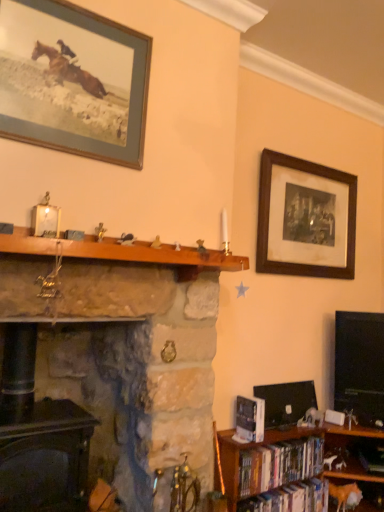
Describe the element at coordinates (250, 418) in the screenshot. I see `white glossy bookshelf at lower right, which is the 1th book in top-to-bottom order` at that location.

What do you see at coordinates (44, 455) in the screenshot?
I see `dark wood fireplace at lower left, acting as the first fireplace starting from the left` at bounding box center [44, 455].

Where is `wooden picture frame at upper right, the 1th picture frame in the back-to-front sequence`? wooden picture frame at upper right, the 1th picture frame in the back-to-front sequence is located at coordinates (305, 218).

This screenshot has height=512, width=384. In order to click on wooden at center in this screenshot , I will do `click(121, 252)`.

Looking at this image, do you think hardcover books at lower right, which is the 2th book from bottom to top, is within wooden bookshelf at lower right, or outside of it?

hardcover books at lower right, which is the 2th book from bottom to top, exists entirely within wooden bookshelf at lower right.

In the image, is hardcover books at lower right, which is the 2th book from bottom to top, positioned in front of or behind wooden bookshelf at lower right?

hardcover books at lower right, which is the 2th book from bottom to top, is behind wooden bookshelf at lower right.

Considering the relative sizes of hardcover books at lower right, the 2th book viewed from the top, and wooden bookshelf at lower right in the image provided, is hardcover books at lower right, the 2th book viewed from the top, wider than wooden bookshelf at lower right?

No.

Is wooden bookshelf at lower right at the back of hardcover books at lower right, the 2th book viewed from the top?

Yes, hardcover books at lower right, the 2th book viewed from the top, is facing away from wooden bookshelf at lower right.

Is blue matte picture frame at upper left, arranged as the 1th picture frame when viewed from the front, located outside wooden at center?

Yes, blue matte picture frame at upper left, arranged as the 1th picture frame when viewed from the front, is located beyond the bounds of wooden at center.

In the scene shown: From the image's perspective, is blue matte picture frame at upper left, which is counted as the 1th picture frame, starting from the left, above or below wooden at center?

Based on their image positions, blue matte picture frame at upper left, which is counted as the 1th picture frame, starting from the left, is located above wooden at center.

Is wooden at center at the back of blue matte picture frame at upper left, arranged as the 1th picture frame when viewed from the front?

No.

Is wooden at center placed right next to blue matte picture frame at upper left, arranged as the 1th picture frame when viewed from the front?

No, wooden at center is not with blue matte picture frame at upper left, arranged as the 1th picture frame when viewed from the front.

Considering the relative sizes of wooden at center and blue matte picture frame at upper left, acting as the second picture frame starting from the right, in the image provided, is wooden at center taller than blue matte picture frame at upper left, acting as the second picture frame starting from the right,?

No.

Which object is wider, wooden at center or blue matte picture frame at upper left, arranged as the 1th picture frame when viewed from the front?

wooden at center is wider.

Is wooden bookshelf at lower right next to black glossy flat-screen tv at right?

No, wooden bookshelf at lower right is not with black glossy flat-screen tv at right.

Does wooden bookshelf at lower right turn towards black glossy flat-screen tv at right?

No, wooden bookshelf at lower right is not aimed at black glossy flat-screen tv at right.

Where is `bookcase located in front of the black glossy flat-screen tv at right`? bookcase located in front of the black glossy flat-screen tv at right is located at coordinates (276, 458).

Is point (358, 426) closer or farther from the camera than point (359, 330)?

Point (358, 426) appears to be closer to the viewer than point (359, 330).

Which object is closer to the camera taking this photo, wooden picture frame at upper right, placed as the 2th picture frame when sorted from left to right, or wooden at center?

Positioned in front is wooden at center.

Is there a large distance between wooden picture frame at upper right, the 2th picture frame positioned from the front, and wooden at center?

That's not correct — wooden picture frame at upper right, the 2th picture frame positioned from the front, is a little close to wooden at center.

From the image's perspective, is wooden picture frame at upper right, placed as the 2th picture frame when sorted from left to right, located above wooden at center?

Yes, from the image's perspective, wooden picture frame at upper right, placed as the 2th picture frame when sorted from left to right, is on top of wooden at center.

How many degrees apart are the facing directions of white glossy bookshelf at lower right, placed as the third book when sorted from bottom to top, and black glossy flat-screen tv at right?

There is a 46.7-degree angle between the facing directions of white glossy bookshelf at lower right, placed as the third book when sorted from bottom to top, and black glossy flat-screen tv at right.

Is white glossy bookshelf at lower right, placed as the third book when sorted from bottom to top, in front of or behind black glossy flat-screen tv at right in the image?

white glossy bookshelf at lower right, placed as the third book when sorted from bottom to top, is in front of black glossy flat-screen tv at right.

Is white glossy bookshelf at lower right, placed as the third book when sorted from bottom to top, turned away from black glossy flat-screen tv at right?

No, white glossy bookshelf at lower right, placed as the third book when sorted from bottom to top, is not facing away from black glossy flat-screen tv at right.

Is white glossy bookshelf at lower right, which is the 1th book in top-to-bottom order, inside the boundaries of black glossy flat-screen tv at right, or outside?

The correct answer is: outside.

Would you say wooden at center is to the left or to the right of black glossy flat-screen tv at right in the picture?

From the image, it's evident that wooden at center is to the left of black glossy flat-screen tv at right.

Which point is more distant from viewer, (x=207, y=264) or (x=349, y=369)?

The point (x=349, y=369) is behind.

In terms of height, does wooden at center look taller or shorter compared to black glossy flat-screen tv at right?

Considering their sizes, wooden at center has less height than black glossy flat-screen tv at right.

Is black glossy flat-screen tv at right located within wooden at center?

No, wooden at center does not contain black glossy flat-screen tv at right.

Where is `book that is the 2nd object located behind the wooden bookshelf at lower right`? book that is the 2nd object located behind the wooden bookshelf at lower right is located at coordinates (279, 464).

Locate an element on the screen. The width and height of the screenshot is (384, 512). shelf lying on the right of blue matte picture frame at upper left, arranged as the 1th picture frame when viewed from the front is located at coordinates (121, 252).

Based on their spatial positions, is dark wood fireplace at lower left, acting as the first fireplace starting from the left, or wooden picture frame at upper right, the 1th picture frame in the back-to-front sequence, further from wooden bookshelf at lower right?

wooden picture frame at upper right, the 1th picture frame in the back-to-front sequence, lies further to wooden bookshelf at lower right than the other object.

When comparing their distances from natural stone fireplace at center, the 1th fireplace positioned from the right, does hardcover books at lower right, which is the 2th book from bottom to top, or wooden picture frame at upper right, the 1th picture frame in the right-to-left sequence, seem further?

wooden picture frame at upper right, the 1th picture frame in the right-to-left sequence, lies further to natural stone fireplace at center, the 1th fireplace positioned from the right, than the other object.

Consider the image. Looking at the image, which one is located closer to hardcover books at lower right, which is the 2th book from bottom to top, wooden at center or blue matte picture frame at upper left, arranged as the 1th picture frame when viewed from the front?

The object closer to hardcover books at lower right, which is the 2th book from bottom to top, is wooden at center.

Based on their spatial positions, is blue matte picture frame at upper left, which is counted as the 1th picture frame, starting from the left, or black glossy flat-screen tv at right closer to white glossy bookshelf at lower right, which is the 1th book in top-to-bottom order?

The object closer to white glossy bookshelf at lower right, which is the 1th book in top-to-bottom order, is black glossy flat-screen tv at right.

From the image, which object appears to be nearer to hardcover books at lower right, which is the 2th book from bottom to top, white glossy bookshelf at lower right, placed as the third book when sorted from bottom to top, or wooden at center?

The object closer to hardcover books at lower right, which is the 2th book from bottom to top, is white glossy bookshelf at lower right, placed as the third book when sorted from bottom to top.

Based on their spatial positions, is wooden at center or wooden bookshelf at lower right closer to black glossy flat-screen tv at right?

Among the two, wooden bookshelf at lower right is located nearer to black glossy flat-screen tv at right.

From the image, which object appears to be nearer to wooden at center, hardcover books at lower right, acting as the 3th book starting from the top, or hardcover books at lower right, the 2th book viewed from the top?

The object closer to wooden at center is hardcover books at lower right, the 2th book viewed from the top.

From the image, which object appears to be nearer to hardcover books at lower right, the 2th book viewed from the top, natural stone fireplace at center, the 1th fireplace positioned from the right, or dark wood fireplace at lower left, acting as the first fireplace starting from the left?

natural stone fireplace at center, the 1th fireplace positioned from the right, is positioned closer to the anchor hardcover books at lower right, the 2th book viewed from the top.

At what (x,y) coordinates should I click in order to perform the action: click on fireplace that lies between wooden at center and dark wood fireplace at lower left, acting as the first fireplace starting from the left, from top to bottom. Please return your answer as a coordinate pair (x, y). The image size is (384, 512). Looking at the image, I should click on (125, 348).

Locate an element on the screen. This screenshot has width=384, height=512. book between blue matte picture frame at upper left, arranged as the second picture frame when viewed from the back, and hardcover books at lower right, the 2th book viewed from the top, in the vertical direction is located at coordinates (250, 418).

I want to click on television between wooden picture frame at upper right, the 1th picture frame in the right-to-left sequence, and white glossy bookshelf at lower right, placed as the third book when sorted from bottom to top, in the up-down direction, so click(x=359, y=365).

Find the location of `shelf between natural stone fireplace at center, the 1th fireplace positioned from the right, and black glossy flat-screen tv at right from left to right`. shelf between natural stone fireplace at center, the 1th fireplace positioned from the right, and black glossy flat-screen tv at right from left to right is located at coordinates (121, 252).